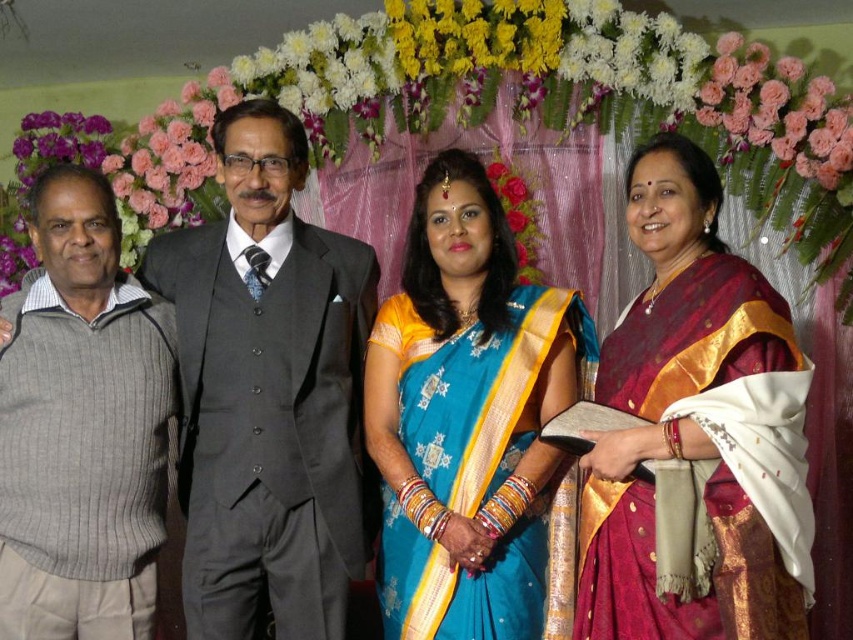
Is dark gray suit at center above blue silk saree at center?

Yes.

Does point (300, 269) lie behind point (558, 625)?

That is True.

Where is `dark gray suit at center`? This screenshot has width=853, height=640. dark gray suit at center is located at coordinates (268, 394).

Is dark gray suit at center thinner than gray ribbed sweater at left?

No.

Is dark gray suit at center wider than gray ribbed sweater at left?

Yes, dark gray suit at center is wider than gray ribbed sweater at left.

Which is in front, point (302, 301) or point (154, 362)?

Positioned in front is point (154, 362).

In order to click on dark gray suit at center in this screenshot , I will do `click(268, 394)`.

Is dark gray suit at center further to the viewer compared to maroon silk saree at center?

Yes.

Does point (344, 316) come farther from viewer compared to point (633, 228)?

Yes, point (344, 316) is farther from viewer.

In order to click on dark gray suit at center in this screenshot , I will do `click(268, 394)`.